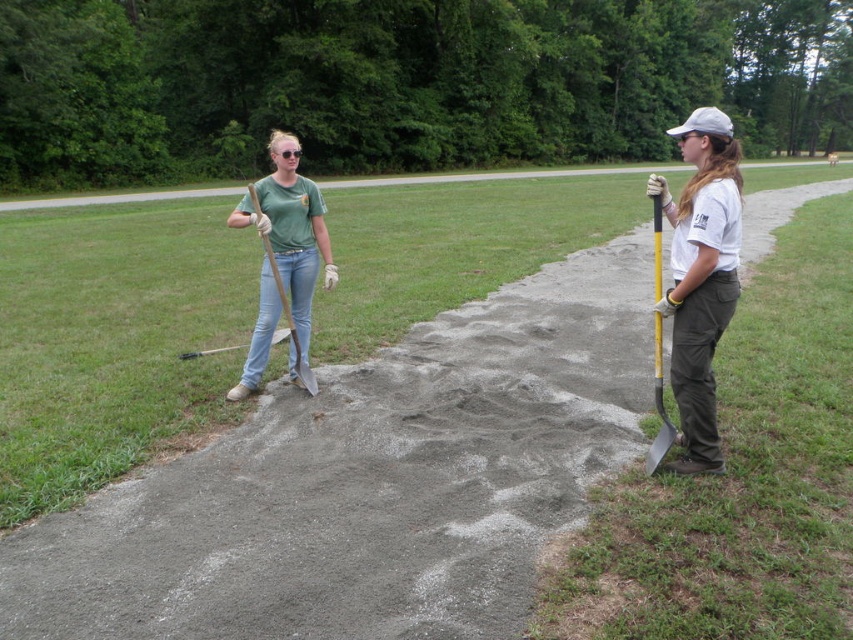
Question: Among these objects, which one is nearest to the camera?

Choices:
 (A) yellow plastic shovel at right
 (B) white fabric baseball cap at upper right
 (C) green grass at right
 (D) wooden shovel at center

Answer: (C)

Question: Which point is farther to the camera?

Choices:
 (A) white fabric baseball cap at upper right
 (B) yellow plastic shovel at right

Answer: (B)

Question: Is matte green shirt at center thinner than wooden shovel at center?

Choices:
 (A) no
 (B) yes

Answer: (A)

Question: Which point appears closest to the camera in this image?

Choices:
 (A) (39, 208)
 (B) (305, 365)
 (C) (677, 300)
 (D) (738, 348)

Answer: (C)

Question: Can you confirm if green grass at right is positioned above matte green shirt at center?

Choices:
 (A) yes
 (B) no

Answer: (B)

Question: Is matte green shirt at center to the left of wooden shovel at center from the viewer's perspective?

Choices:
 (A) yes
 (B) no

Answer: (A)